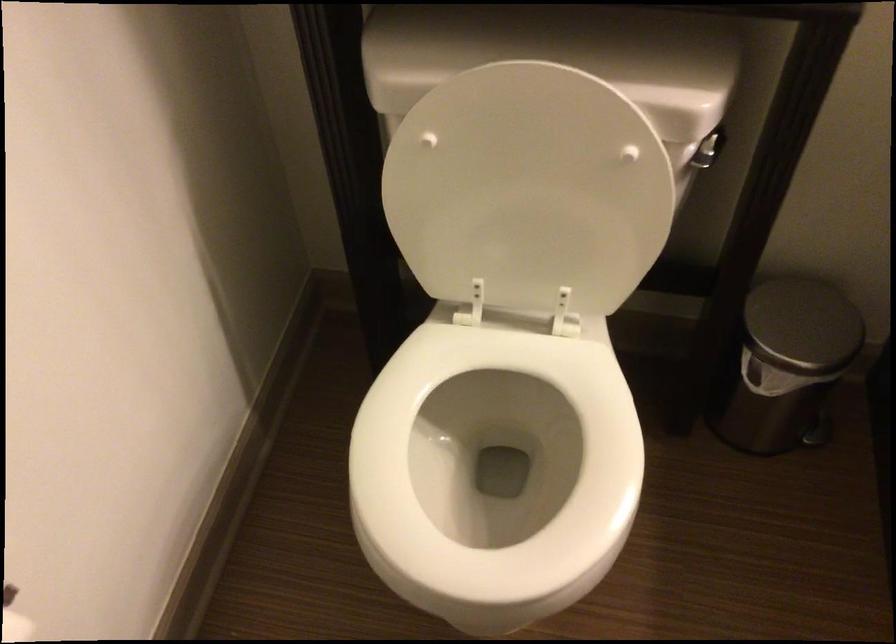
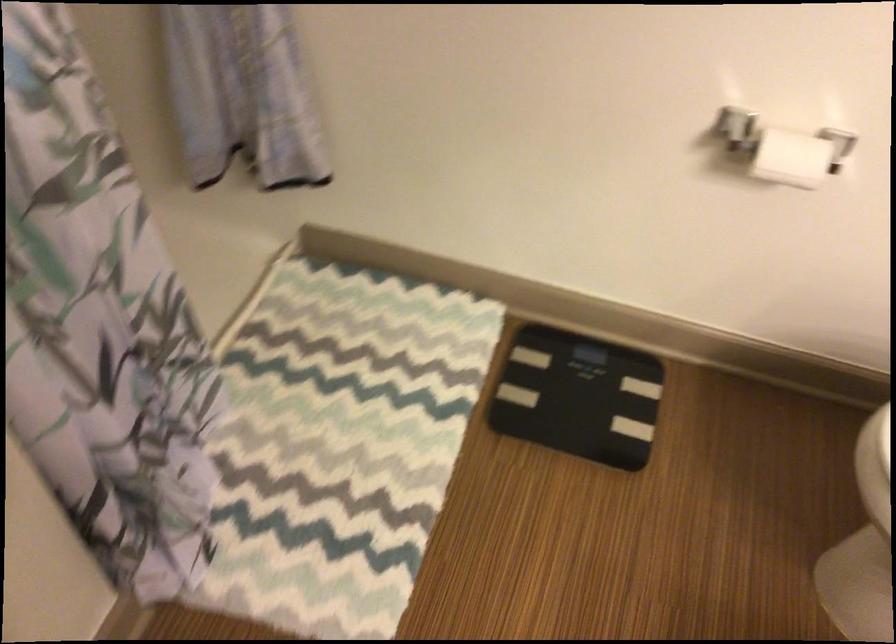
In the scene shown: The images are taken continuously from a first-person perspective. In which direction is your viewpoint rotating?

The camera rotated toward left-down.